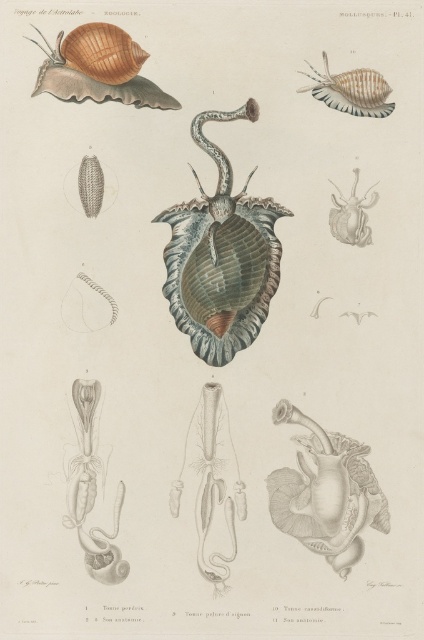
Can you confirm if smooth white shell at center is bigger than shiny beige shell at upper right?

Indeed, smooth white shell at center has a larger size compared to shiny beige shell at upper right.

Is smooth white shell at center wider than shiny beige shell at upper right?

Yes.

Is point (348, 467) positioned after point (317, 88)?

No, it is not.

The height and width of the screenshot is (640, 424). Identify the location of smooth white shell at center. (326, 493).

Who is higher up, shiny metallic shell at center or smooth white shell at center?

shiny metallic shell at center is higher up.

This screenshot has width=424, height=640. What do you see at coordinates (222, 256) in the screenshot?
I see `shiny metallic shell at center` at bounding box center [222, 256].

You are a GUI agent. You are given a task and a screenshot of the screen. Output one action in this format:
    pyautogui.click(x=<x>, y=<y>)
    Task: Click on the shiny metallic shell at center
    
    Given the screenshot: What is the action you would take?
    pyautogui.click(x=222, y=256)

Measure the distance between shiny beige shell at upper right and camera.

They are 4.49 feet apart.

Who is positioned more to the left, shiny beige shell at upper right or matte white snail at upper right?

shiny beige shell at upper right is more to the left.

Is point (298, 90) closer to camera compared to point (354, 234)?

Yes, it is.

Find the location of `shiny beige shell at upper right`. shiny beige shell at upper right is located at coordinates (351, 90).